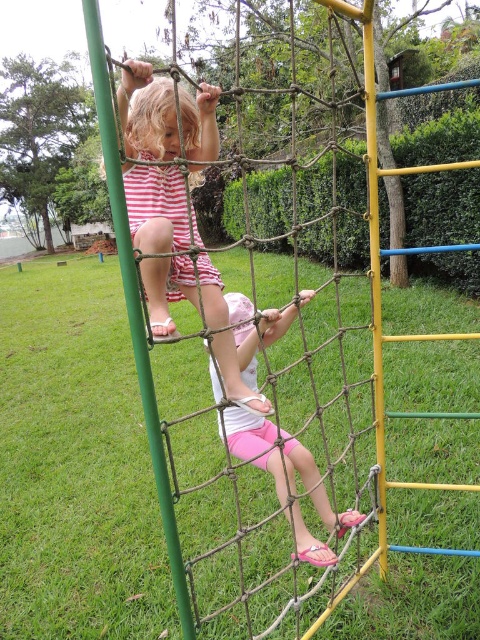
Does striped cotton dress at upper left come behind pink fabric shorts at lower center?

No.

Does striped cotton dress at upper left have a greater width compared to pink fabric shorts at lower center?

No, striped cotton dress at upper left is not wider than pink fabric shorts at lower center.

Where is `striped cotton dress at upper left`? striped cotton dress at upper left is located at coordinates (156, 208).